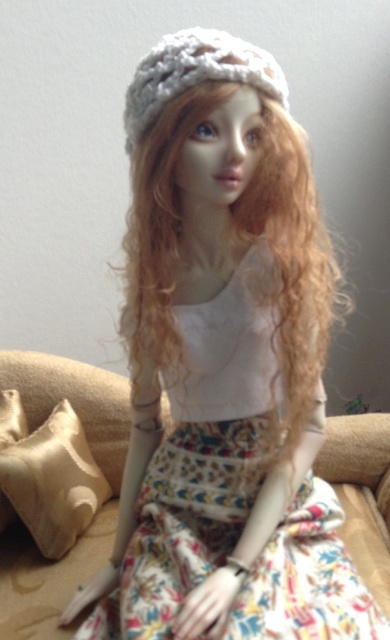
You are designing a new doll and want to ensure the proportions match the existing one. Given the doll in the image has curly blonde hair at center and white knitted hat at upper center, which object should you make wider if you want to maintain the same proportions?

To maintain the same proportions, you should make the curly blonde hair at center wider since it is naturally wider than the white knitted hat at upper center in the original design.